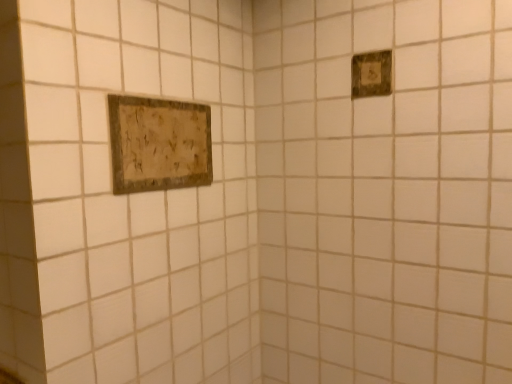
Locate an element on the screen. The height and width of the screenshot is (384, 512). rustic wood picture frame at upper left is located at coordinates (159, 144).

Describe the element at coordinates (159, 144) in the screenshot. Image resolution: width=512 pixels, height=384 pixels. I see `rustic wood picture frame at upper left` at that location.

Where is `rustic wood picture frame at upper left`? Image resolution: width=512 pixels, height=384 pixels. rustic wood picture frame at upper left is located at coordinates (159, 144).